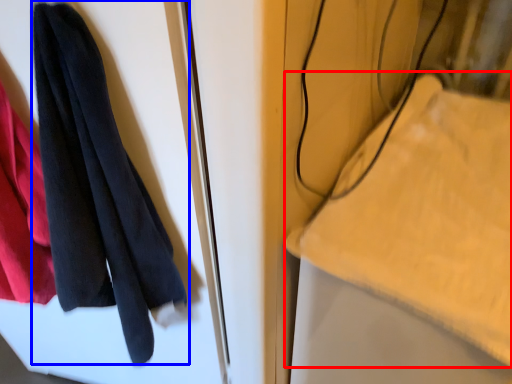
Question: Which object appears closest to the camera in this image, cloth (highlighted by a red box) or towel (highlighted by a blue box)?

Choices:
 (A) cloth
 (B) towel

Answer: (B)